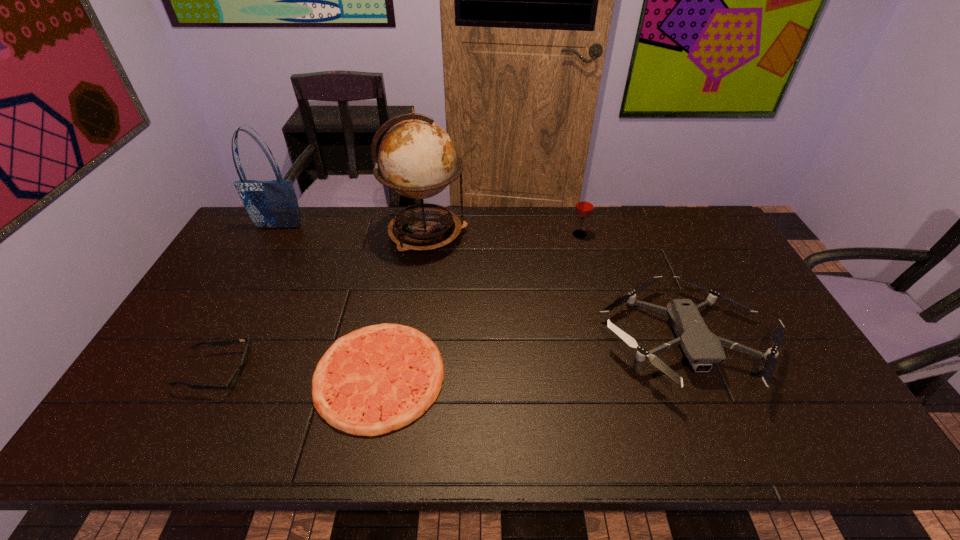
The width and height of the screenshot is (960, 540). I want to click on the tallest object, so click(417, 158).

Identify the location of the second tallest object. This screenshot has width=960, height=540. (270, 204).

Locate an element on the screen. The width and height of the screenshot is (960, 540). the third tallest object is located at coordinates (584, 207).

Identify the location of drone. (702, 348).

The width and height of the screenshot is (960, 540). In order to click on the fifth tallest object in this screenshot , I will do `click(234, 379)`.

At what (x,y) coordinates should I click in order to perform the action: click on the shortest object. Please return your answer as a coordinate pair (x, y). Looking at the image, I should click on (379, 378).

The image size is (960, 540). Find the location of `vacant space situated at the center of the tallest object`. vacant space situated at the center of the tallest object is located at coordinates (581, 234).

Where is `vacant space located on the front-facing side of the fifth shortest object`? The height and width of the screenshot is (540, 960). vacant space located on the front-facing side of the fifth shortest object is located at coordinates (258, 266).

Where is `vacant space situated on the right of the fourth shortest object`? vacant space situated on the right of the fourth shortest object is located at coordinates (667, 235).

At what (x,y) coordinates should I click in order to perform the action: click on blank space located on the front-facing side of the drone. Please return your answer as a coordinate pair (x, y). This screenshot has width=960, height=540. Looking at the image, I should click on (722, 433).